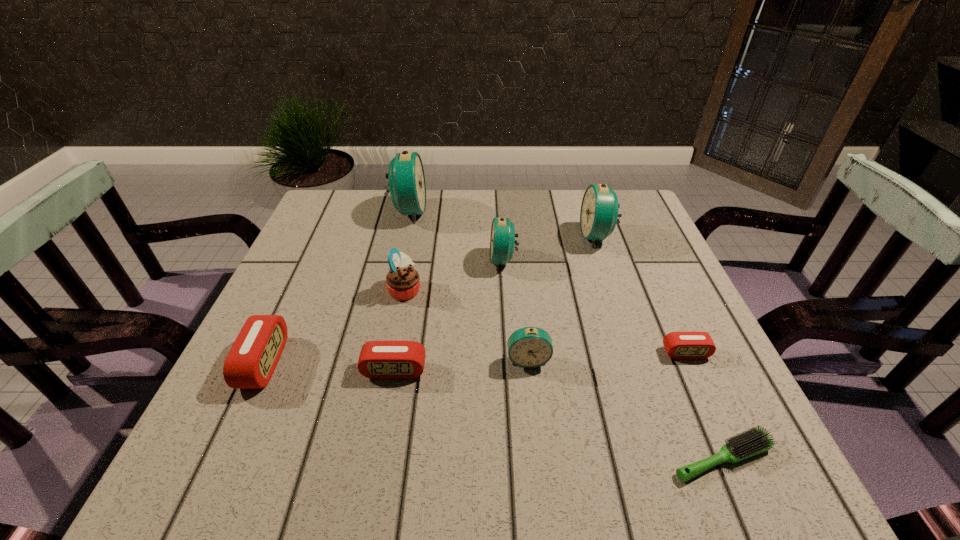
Where is `the sixth tallest object`? This screenshot has width=960, height=540. the sixth tallest object is located at coordinates (253, 357).

I want to click on the seventh tallest object, so click(378, 359).

Locate an element on the screen. The width and height of the screenshot is (960, 540). the second smallest pink alarm clock is located at coordinates (378, 359).

Where is `the rightmost alarm clock`? the rightmost alarm clock is located at coordinates (679, 345).

I want to click on the shortest alarm clock, so click(x=679, y=345).

Identify the location of the nearest object. (754, 441).

Image resolution: width=960 pixels, height=540 pixels. I want to click on light hairbrush, so click(x=754, y=441).

Locate an element on the screen. vacant space situated 0.160m on the front-facing side of the tallest object is located at coordinates (484, 212).

Image resolution: width=960 pixels, height=540 pixels. In order to click on vacant area located on the front-facing side of the rightmost blue alarm clock in this screenshot , I will do `click(523, 236)`.

You are a GUI agent. You are given a task and a screenshot of the screen. Output one action in this format:
    pyautogui.click(x=<x>, y=<y>)
    Task: Click on the vacant area located 0.210m on the front-facing side of the rightmost blue alarm clock
    The width and height of the screenshot is (960, 540).
    Given the screenshot: What is the action you would take?
    pyautogui.click(x=500, y=236)